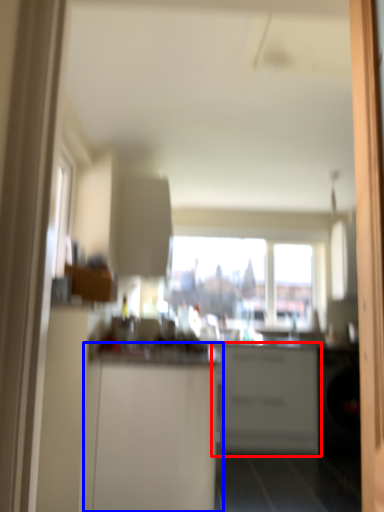
Question: Which of the following is the closest to the observer, cabinetry (highlighted by a red box) or cabinetry (highlighted by a blue box)?

Choices:
 (A) cabinetry
 (B) cabinetry

Answer: (B)